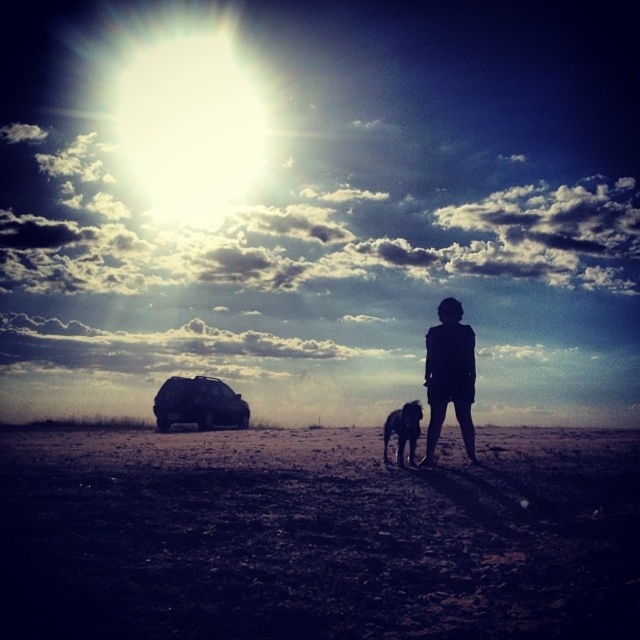
Question: Does silhouette figure at center appear on the left side of shiny black dog at center?

Choices:
 (A) yes
 (B) no

Answer: (B)

Question: Among these points, which one is nearest to the camera?

Choices:
 (A) (448, 360)
 (B) (387, 486)
 (C) (396, 458)
 (D) (243, 406)

Answer: (B)

Question: Can you confirm if dark brown dirt field at center is smaller than black matte suv at lower left?

Choices:
 (A) no
 (B) yes

Answer: (A)

Question: Which object is positioned farthest from the black matte suv at lower left?

Choices:
 (A) shiny black dog at center
 (B) silhouette figure at center
 (C) dark brown dirt field at center

Answer: (B)

Question: Which point appears farthest from the camera in this image?

Choices:
 (A) (132, 595)
 (B) (436, 422)
 (C) (228, 397)
 (D) (406, 413)

Answer: (C)

Question: Can you confirm if dark brown dirt field at center is positioned below shiny black dog at center?

Choices:
 (A) no
 (B) yes

Answer: (B)